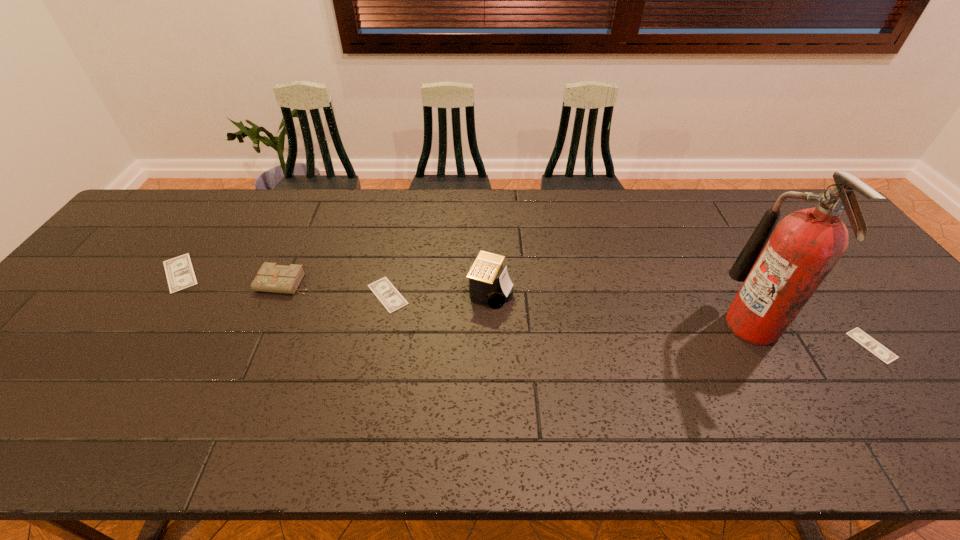
Image resolution: width=960 pixels, height=540 pixels. I want to click on the tallest object, so click(x=780, y=275).

This screenshot has height=540, width=960. What are the coordinates of `fire extinguisher` in the screenshot? It's located at (780, 275).

The width and height of the screenshot is (960, 540). Find the location of `free space located on the front of the leftmost money`. free space located on the front of the leftmost money is located at coordinates (x=128, y=349).

You are a GUI agent. You are given a task and a screenshot of the screen. Output one action in this format:
    pyautogui.click(x=<x>, y=<y>)
    Task: Click on the vacant space located 0.400m on the right of the second shortest object
    This screenshot has width=960, height=540.
    Given the screenshot: What is the action you would take?
    pyautogui.click(x=560, y=295)

This screenshot has height=540, width=960. Identify the location of free space located 0.150m on the left of the rightmost money. (792, 346).

This screenshot has width=960, height=540. I want to click on blank area located on the back of the third tallest object, so click(x=318, y=207).

Identify the location of vacant space located 0.120m on the front of the calculator. (492, 347).

Locate an element on the screen. vacant space located on the front of the tallest object near the operation label is located at coordinates (638, 325).

The image size is (960, 540). Find the location of `free space located 0.390m on the front of the tallest object near the operation label`. free space located 0.390m on the front of the tallest object near the operation label is located at coordinates (570, 325).

Where is `blank area located on the front of the tallest object near the operation label`? blank area located on the front of the tallest object near the operation label is located at coordinates (698, 325).